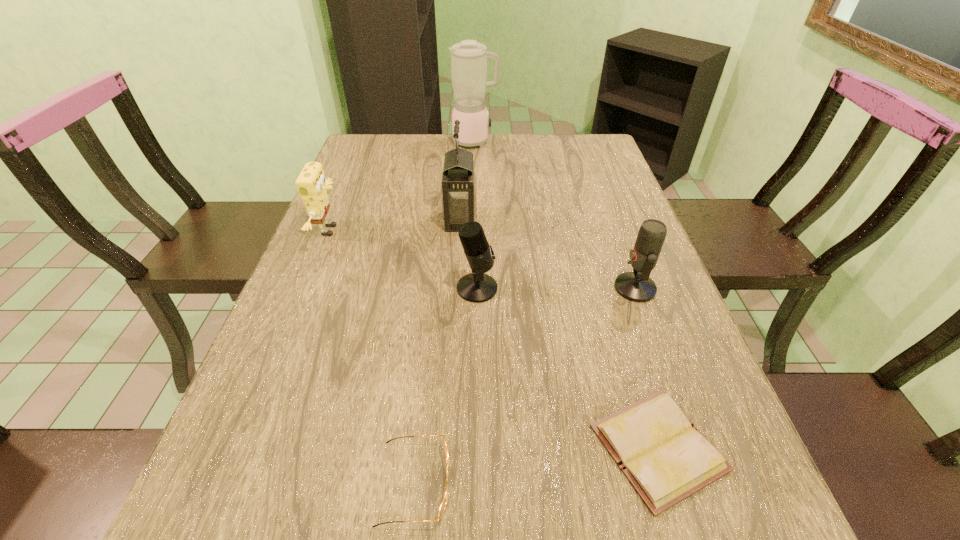
Identify the location of microphone located in the right edge section of the desktop. (637, 286).

Image resolution: width=960 pixels, height=540 pixels. Find the location of `diary at the right edge`. diary at the right edge is located at coordinates (666, 459).

In the image, there is a desktop. At what (x,y) coordinates should I click in order to perform the action: click on blank space at the far edge. Please return your answer as a coordinate pair (x, y). This screenshot has width=960, height=540. Looking at the image, I should click on (467, 147).

The width and height of the screenshot is (960, 540). Find the location of `free space at the left edge`. free space at the left edge is located at coordinates (292, 348).

Where is `vacant region at the right edge`? vacant region at the right edge is located at coordinates (748, 510).

This screenshot has width=960, height=540. Find the location of `free space at the far left corner`. free space at the far left corner is located at coordinates (346, 167).

Image resolution: width=960 pixels, height=540 pixels. In order to click on vacant space at the far right corner of the desktop in this screenshot , I will do `click(591, 138)`.

Where is `free spot between the shortest object and the left microphone`? The image size is (960, 540). free spot between the shortest object and the left microphone is located at coordinates (567, 368).

Locate an element on the screen. vacant space that is in between the left microphone and the diary is located at coordinates (567, 368).

The image size is (960, 540). Identify the location of vacant area that lies between the farthest object and the sponge. (402, 186).